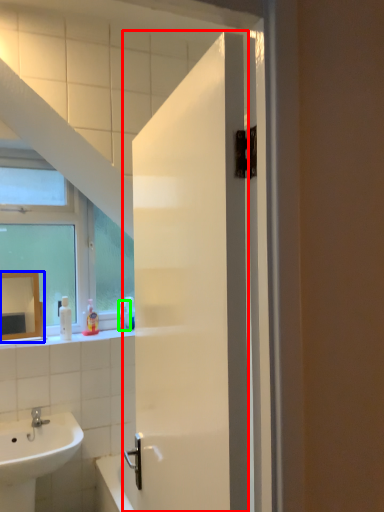
Question: Which object is positioned farthest from door (highlighted by a red box)? Select from mirror (highlighted by a blue box) and toiletry (highlighted by a green box).

Choices:
 (A) mirror
 (B) toiletry

Answer: (B)